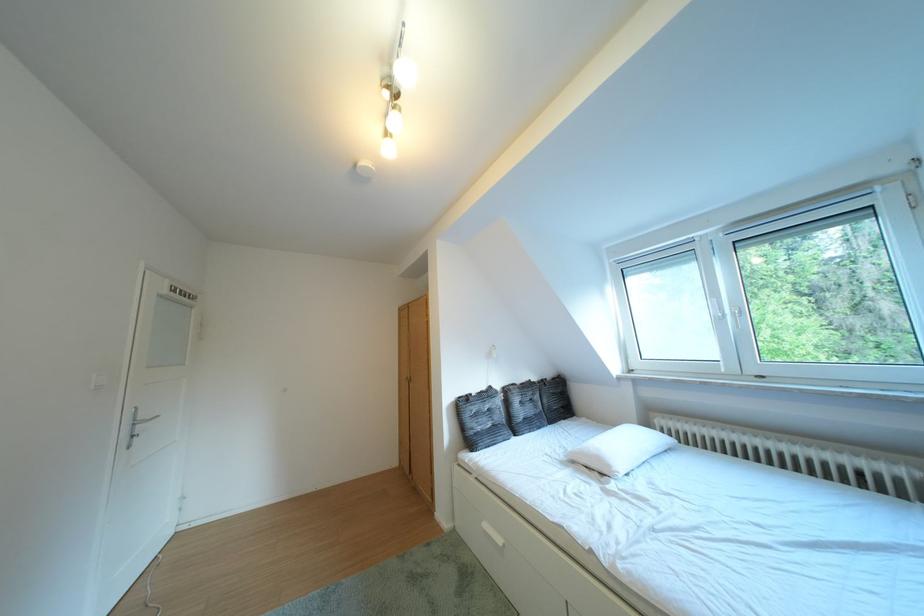
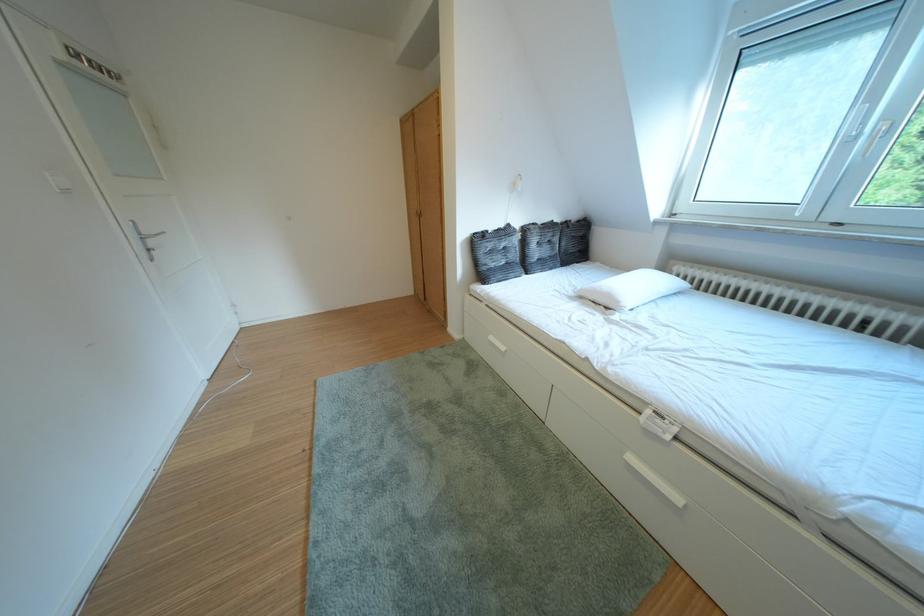
Find the pixel in the second image that matches pixel 613 464 in the first image.

(623, 301)